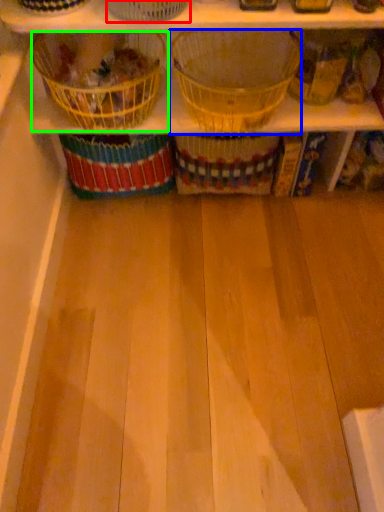
Question: Based on their relative distances, which object is farther from basket (highlighted by a red box)? Choose from basket (highlighted by a blue box) and basket (highlighted by a green box).

Choices:
 (A) basket
 (B) basket

Answer: (A)